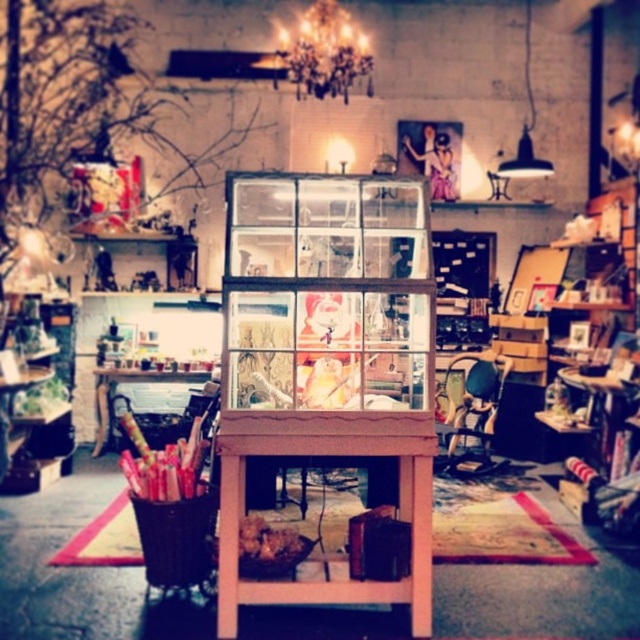
Is point (307, 362) farther from camera compared to point (365, 419)?

That is True.

Does clear plastic cabinet at center have a lesser height compared to pink wood table at center?

No, clear plastic cabinet at center is not shorter than pink wood table at center.

Is point (388, 317) positioned behind point (417, 611)?

Yes, point (388, 317) is farther from viewer.

At what (x,y) coordinates should I click in order to perform the action: click on clear plastic cabinet at center. Please return your answer as a coordinate pair (x, y). This screenshot has width=640, height=640. Looking at the image, I should click on (326, 292).